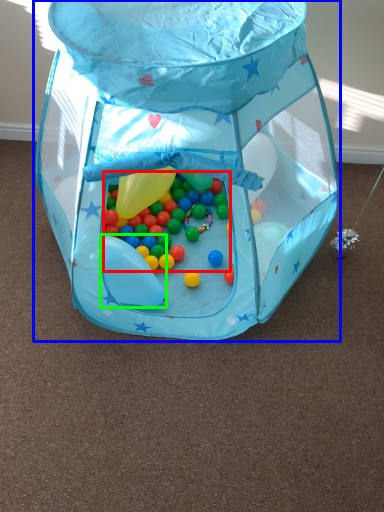
Question: Which object is the closest to the candy (highlighted by a red box)? Choose among these: toy (highlighted by a blue box) or balloon (highlighted by a green box).

Choices:
 (A) toy
 (B) balloon

Answer: (B)